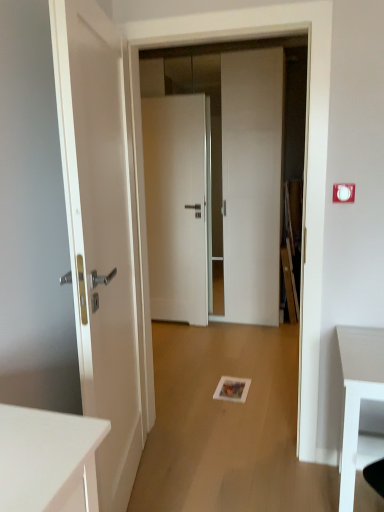
Question: Considering the relative positions of matte white door at left, acting as the 3th door starting from the back, and white glossy door at center, the second door when ordered from front to back, in the image provided, is matte white door at left, acting as the 3th door starting from the back, in front of white glossy door at center, the second door when ordered from front to back,?

Choices:
 (A) no
 (B) yes

Answer: (B)

Question: Is white glossy door at center, the second door when ordered from front to back, located within matte white door at left, acting as the 3th door starting from the back?

Choices:
 (A) no
 (B) yes

Answer: (A)

Question: From the image's perspective, does matte white door at left, which is counted as the 1th door, starting from the front, appear lower than white glossy door at center, the second door when ordered from front to back?

Choices:
 (A) no
 (B) yes

Answer: (B)

Question: Is matte white door at left, which is counted as the 1th door, starting from the front, next to white glossy door at center, the second door when ordered from front to back, and touching it?

Choices:
 (A) yes
 (B) no

Answer: (B)

Question: From the image's perspective, is matte white door at left, which is counted as the 1th door, starting from the front, over white glossy door at center, which ranks as the second door in back-to-front order?

Choices:
 (A) yes
 (B) no

Answer: (B)

Question: Does point (152, 245) appear closer or farther from the camera than point (137, 329)?

Choices:
 (A) farther
 (B) closer

Answer: (A)

Question: From the image's perspective, relative to matte white door at left, acting as the 3th door starting from the back, is white glossy door at center, which ranks as the second door in back-to-front order, above or below?

Choices:
 (A) below
 (B) above

Answer: (B)

Question: In terms of height, does white glossy door at center, the second door when ordered from front to back, look taller or shorter compared to matte white door at left, acting as the 3th door starting from the back?

Choices:
 (A) short
 (B) tall

Answer: (B)

Question: Visually, is white glossy door at center, the second door when ordered from front to back, positioned to the left or to the right of matte white door at left, acting as the 3th door starting from the back?

Choices:
 (A) right
 (B) left

Answer: (A)

Question: Based on their positions, is white matte door at center, acting as the third door starting from the front, located to the left or right of white glossy door at center, which ranks as the second door in back-to-front order?

Choices:
 (A) left
 (B) right

Answer: (A)

Question: Is white matte door at center, acting as the third door starting from the front, bigger or smaller than white glossy door at center, the second door when ordered from front to back?

Choices:
 (A) small
 (B) big

Answer: (A)

Question: From the image's perspective, is white matte door at center, acting as the third door starting from the front, located above or below white glossy door at center, which ranks as the second door in back-to-front order?

Choices:
 (A) above
 (B) below

Answer: (B)

Question: From a real-world perspective, relative to white glossy door at center, which ranks as the second door in back-to-front order, is white matte door at center, acting as the third door starting from the front, vertically above or below?

Choices:
 (A) below
 (B) above

Answer: (A)

Question: Considering their positions, is white plastic electric outlet at upper right located in front of or behind white glossy door at center, the second door when ordered from front to back?

Choices:
 (A) behind
 (B) front

Answer: (B)

Question: Considering the positions of white plastic electric outlet at upper right and white glossy door at center, which ranks as the second door in back-to-front order, in the image, is white plastic electric outlet at upper right wider or thinner than white glossy door at center, which ranks as the second door in back-to-front order,?

Choices:
 (A) thin
 (B) wide

Answer: (A)